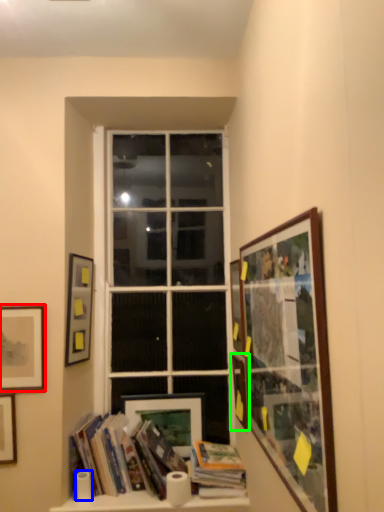
Question: Considering the real-world distances, which object is closest to picture frame (highlighted by a red box)? toilet paper (highlighted by a blue box) or picture frame (highlighted by a green box).

Choices:
 (A) toilet paper
 (B) picture frame

Answer: (A)